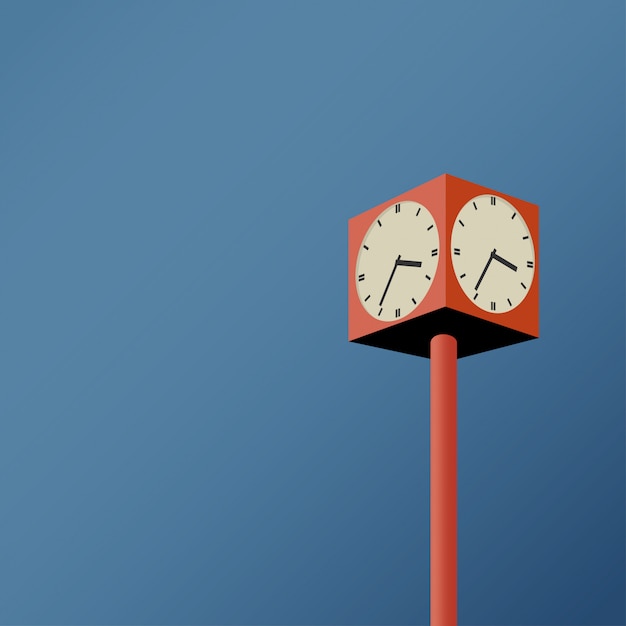
Locate an element on the screen. clock hands is located at coordinates (385, 284), (408, 250), (489, 258), (506, 255).